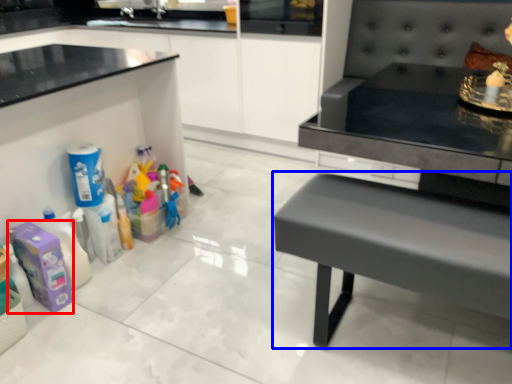
Question: Which of the following is the closest to the observer, cleaning product (highlighted by a red box) or table (highlighted by a blue box)?

Choices:
 (A) cleaning product
 (B) table

Answer: (B)